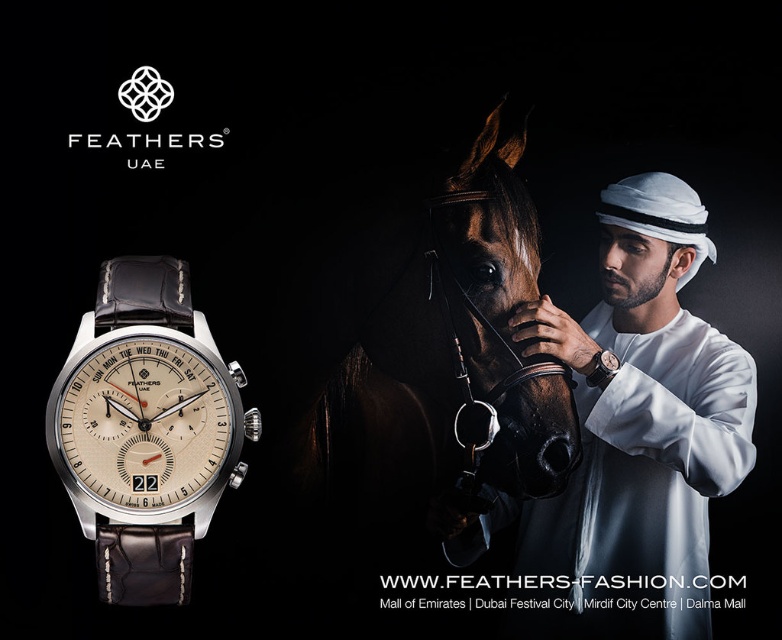
You are a photographer standing in front of the Feathers UAE advertisement. You want to take a closeup photo of the satin brown leather watch at center. The camera you are using has a minimum focusing distance of 1.5 meters. Can you take the photo without moving closer?

The satin brown leather watch at center is 1.85 meters away from viewer. Since the minimum focusing distance is 1.5 meters, the photographer can take the closeup photo without moving closer because the distance is sufficient.